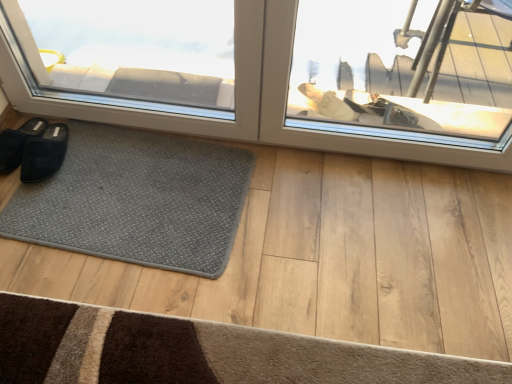
What do you see at coordinates (137, 200) in the screenshot?
I see `gray textured mat at lower left` at bounding box center [137, 200].

Locate an element on the screen. The height and width of the screenshot is (384, 512). gray textured mat at lower left is located at coordinates (137, 200).

This screenshot has width=512, height=384. I want to click on gray textured mat at lower left, so click(137, 200).